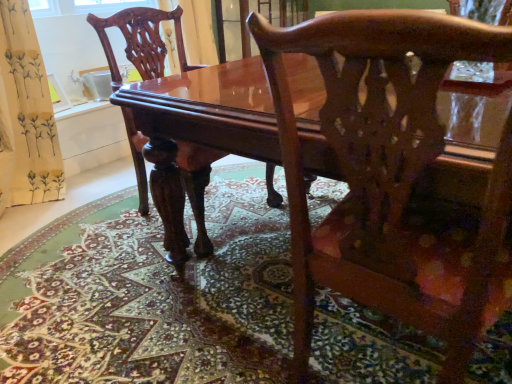
What do you see at coordinates (384, 161) in the screenshot? The width and height of the screenshot is (512, 384). I see `glossy wood chair at center, acting as the first chair starting from the front` at bounding box center [384, 161].

The height and width of the screenshot is (384, 512). In order to click on glossy wood chair at center, placed as the first chair when sorted from back to front in this screenshot , I will do `click(141, 41)`.

Find the location of `glossy wood table at center`. glossy wood table at center is located at coordinates (208, 109).

I want to click on carpeted floor at center, so click(151, 295).

Do you think carpeted floor at center is within glossy wood table at center, or outside of it?

The correct answer is: outside.

From a real-world perspective, between carpeted floor at center and glossy wood table at center, who is vertically lower?

carpeted floor at center is physically lower.

Could you tell me if carpeted floor at center is turned towards glossy wood table at center?

No, carpeted floor at center is not aimed at glossy wood table at center.

From the image's perspective, is carpeted floor at center located above or below glossy wood table at center?

carpeted floor at center is situated lower than glossy wood table at center in the image.

Is carpeted floor at center facing away from glossy wood chair at center, which is the first chair in left-to-right order?

No, carpeted floor at center is not facing away from glossy wood chair at center, which is the first chair in left-to-right order.

Between carpeted floor at center and glossy wood chair at center, placed as the 2th chair when sorted from front to back, which one is positioned in front?

carpeted floor at center is closer to the camera.

Considering the sizes of objects carpeted floor at center and glossy wood chair at center, placed as the 2th chair when sorted from front to back, in the image provided, who is taller, carpeted floor at center or glossy wood chair at center, placed as the 2th chair when sorted from front to back,?

Standing taller between the two is glossy wood chair at center, placed as the 2th chair when sorted from front to back.

Considering the relative sizes of carpeted floor at center and glossy wood chair at center, the second chair viewed from the right, in the image provided, is carpeted floor at center wider than glossy wood chair at center, the second chair viewed from the right,?

Yes, carpeted floor at center is wider than glossy wood chair at center, the second chair viewed from the right.

Can you tell me how much glossy wood chair at center, which ranks as the 1th chair in right-to-left order, and carpeted floor at center differ in facing direction?

The facing directions of glossy wood chair at center, which ranks as the 1th chair in right-to-left order, and carpeted floor at center are 176 degrees apart.

From the picture: Considering the sizes of objects glossy wood chair at center, which ranks as the 1th chair in right-to-left order, and carpeted floor at center in the image provided, who is thinner, glossy wood chair at center, which ranks as the 1th chair in right-to-left order, or carpeted floor at center?

glossy wood chair at center, which ranks as the 1th chair in right-to-left order.

Is glossy wood chair at center, which is the second chair in back-to-front order, bigger or smaller than carpeted floor at center?

glossy wood chair at center, which is the second chair in back-to-front order, is bigger than carpeted floor at center.

Locate an element on the screen. chair located behind the glossy wood table at center is located at coordinates (141, 41).

Which point is more distant from viewer, (x=338, y=176) or (x=181, y=46)?

→ The point (x=181, y=46) is behind.

Does glossy wood table at center appear on the left side of glossy wood chair at center, which is the first chair in left-to-right order?

In fact, glossy wood table at center is to the right of glossy wood chair at center, which is the first chair in left-to-right order.

From a real-world perspective, which object stands above the other?

From a 3D spatial view, glossy wood chair at center, placed as the 2th chair when sorted from front to back, is above.

Which of these two, glossy wood chair at center, which is the first chair in left-to-right order, or carpeted floor at center, is wider?

carpeted floor at center is wider.

From the image's perspective, which is below, glossy wood chair at center, placed as the 2th chair when sorted from front to back, or carpeted floor at center?

From the image's view, carpeted floor at center is below.

Considering the positions of objects glossy wood chair at center, the second chair viewed from the right, and carpeted floor at center in the image provided, who is more to the right, glossy wood chair at center, the second chair viewed from the right, or carpeted floor at center?

Positioned to the right is glossy wood chair at center, the second chair viewed from the right.

From a real-world perspective, is glossy wood chair at center, the second chair viewed from the right, positioned above or below carpeted floor at center?

glossy wood chair at center, the second chair viewed from the right, is situated higher than carpeted floor at center in the real world.

Considering the positions of objects glossy wood chair at center, placed as the first chair when sorted from back to front, and glossy wood chair at center, which is the second chair in back-to-front order, in the image provided, who is more to the left, glossy wood chair at center, placed as the first chair when sorted from back to front, or glossy wood chair at center, which is the second chair in back-to-front order,?

From the viewer's perspective, glossy wood chair at center, placed as the first chair when sorted from back to front, appears more on the left side.

Who is taller, glossy wood chair at center, the second chair viewed from the right, or glossy wood chair at center, which ranks as the 1th chair in right-to-left order?

Standing taller between the two is glossy wood chair at center, which ranks as the 1th chair in right-to-left order.

Between glossy wood chair at center, which is the first chair in left-to-right order, and glossy wood chair at center, acting as the first chair starting from the front, which one has larger size?

glossy wood chair at center, which is the first chair in left-to-right order.

From the image's perspective, would you say glossy wood chair at center, which is the first chair in left-to-right order, is shown under glossy wood chair at center, arranged as the 2th chair when viewed from the left?

Incorrect, from the image's perspective, glossy wood chair at center, which is the first chair in left-to-right order, is higher than glossy wood chair at center, arranged as the 2th chair when viewed from the left.

Is carpeted floor at center surrounded by glossy wood table at center?

Definitely not — carpeted floor at center is not inside glossy wood table at center.

Is glossy wood table at center oriented away from carpeted floor at center?

glossy wood table at center is not turned away from carpeted floor at center.

Relative to carpeted floor at center, is glossy wood table at center in front or behind?

glossy wood table at center is behind carpeted floor at center.

Considering the positions of point (448, 109) and point (335, 373), is point (448, 109) closer or farther from the camera than point (335, 373)?

Clearly, point (448, 109) is closer to the camera than point (335, 373).

Where is `table above the carpeted floor at center (from a real-world perspective)`? table above the carpeted floor at center (from a real-world perspective) is located at coordinates (208, 109).

I want to click on chair that is the 1st object to the right of the carpeted floor at center, starting at the anchor, so click(141, 41).

Considering their positions, is glossy wood table at center positioned further to glossy wood chair at center, arranged as the 2th chair when viewed from the left, than glossy wood chair at center, the second chair viewed from the right?

Based on the image, glossy wood chair at center, the second chair viewed from the right, appears to be further to glossy wood chair at center, arranged as the 2th chair when viewed from the left.

From the image, which object appears to be nearer to glossy wood chair at center, which ranks as the 1th chair in right-to-left order, carpeted floor at center or glossy wood chair at center, placed as the first chair when sorted from back to front?

Among the two, carpeted floor at center is located nearer to glossy wood chair at center, which ranks as the 1th chair in right-to-left order.

Looking at the image, which one is located closer to glossy wood table at center, glossy wood chair at center, the second chair viewed from the right, or carpeted floor at center?

The object closer to glossy wood table at center is glossy wood chair at center, the second chair viewed from the right.

In the scene shown: From the image, which object appears to be nearer to glossy wood chair at center, arranged as the 2th chair when viewed from the left, glossy wood chair at center, placed as the 2th chair when sorted from front to back, or glossy wood table at center?

glossy wood table at center is closer to glossy wood chair at center, arranged as the 2th chair when viewed from the left.

Which object lies nearer to the anchor point glossy wood chair at center, the second chair viewed from the right, glossy wood chair at center, which is the second chair in back-to-front order, or glossy wood table at center?

glossy wood table at center.

From the image, which object appears to be farther from glossy wood chair at center, placed as the 2th chair when sorted from front to back, glossy wood chair at center, acting as the first chair starting from the front, or carpeted floor at center?

glossy wood chair at center, acting as the first chair starting from the front, is further to glossy wood chair at center, placed as the 2th chair when sorted from front to back.

When comparing their distances from carpeted floor at center, does glossy wood table at center or glossy wood chair at center, placed as the 2th chair when sorted from front to back, seem further?

glossy wood table at center.

Based on their spatial positions, is glossy wood chair at center, arranged as the 2th chair when viewed from the left, or glossy wood chair at center, placed as the 2th chair when sorted from front to back, further from glossy wood table at center?

Based on the image, glossy wood chair at center, placed as the 2th chair when sorted from front to back, appears to be further to glossy wood table at center.

Where is `table positioned between glossy wood chair at center, arranged as the 2th chair when viewed from the left, and glossy wood chair at center, placed as the first chair when sorted from back to front, from near to far`? The image size is (512, 384). table positioned between glossy wood chair at center, arranged as the 2th chair when viewed from the left, and glossy wood chair at center, placed as the first chair when sorted from back to front, from near to far is located at coordinates point(208,109).

What are the coordinates of `mat between glossy wood chair at center, acting as the first chair starting from the front, and glossy wood chair at center, the second chair viewed from the right, in the front-back direction` in the screenshot? It's located at (151, 295).

Image resolution: width=512 pixels, height=384 pixels. In order to click on table between carpeted floor at center and glossy wood chair at center, which is the first chair in left-to-right order, along the z-axis in this screenshot , I will do `click(208, 109)`.

Identify the location of table between carpeted floor at center and glossy wood chair at center, acting as the first chair starting from the front. (208, 109).